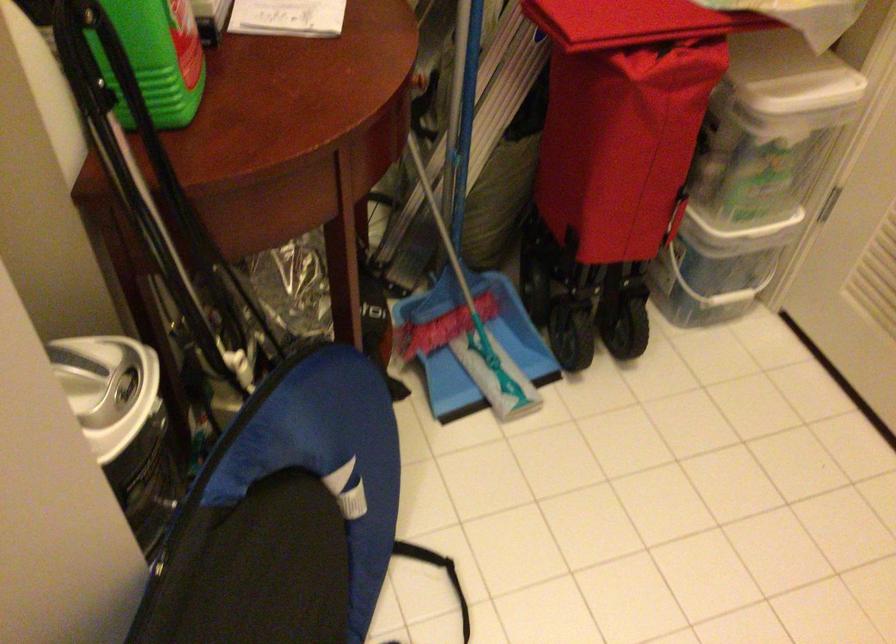
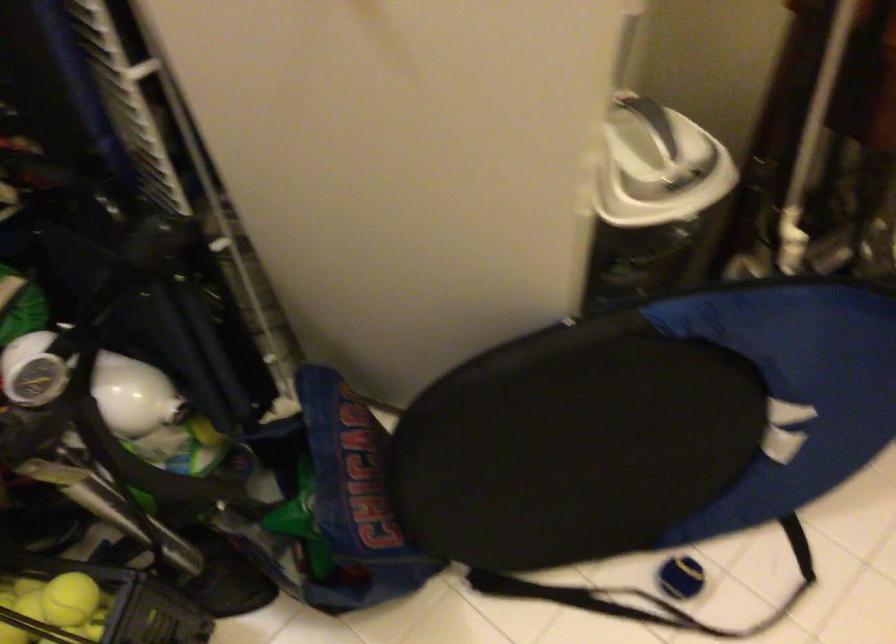
First-person continuous shooting, in which direction is the camera rotating?

The rotation direction of the camera is left-down.